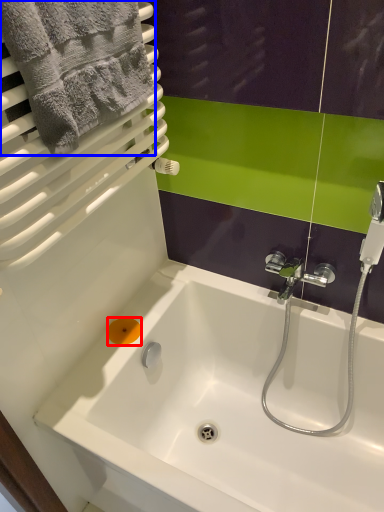
Question: Which object appears farthest to the camera in this image, soap (highlighted by a red box) or towel (highlighted by a blue box)?

Choices:
 (A) soap
 (B) towel

Answer: (A)